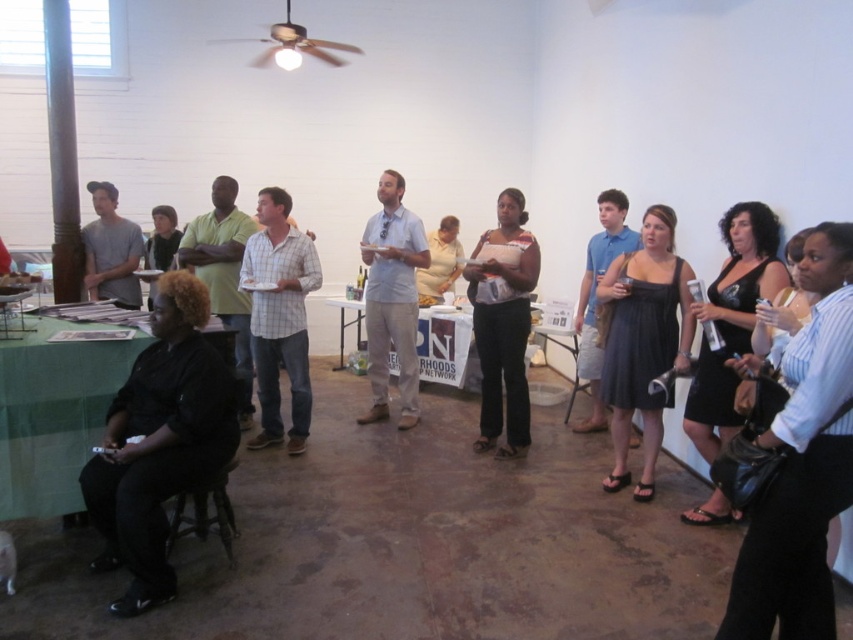
Does plaid shirt at center have a larger size compared to light blue cotton shirt at center?

No.

Who is shorter, plaid shirt at center or light blue cotton shirt at center?

plaid shirt at center

The image size is (853, 640). Describe the element at coordinates (279, 316) in the screenshot. I see `plaid shirt at center` at that location.

Identify the location of plaid shirt at center. This screenshot has height=640, width=853. (279, 316).

Is green fabric table at lower left wider than matte black dress at center?

Yes.

Which of these two, green fabric table at lower left or matte black dress at center, stands taller?

Standing taller between the two is matte black dress at center.

Is point (99, 396) closer to viewer compared to point (477, 262)?

Yes, point (99, 396) is closer to viewer.

Identify the location of green fabric table at lower left. This screenshot has height=640, width=853. (55, 412).

In the scene shown: Who is more forward, [845,305] or [82,408]?

Point [845,305] is in front.

Measure the distance between black dress at right and green fabric table at lower left.

black dress at right is 2.38 meters from green fabric table at lower left.

In order to click on black dress at right in this screenshot , I will do `click(802, 464)`.

The width and height of the screenshot is (853, 640). In order to click on black dress at right in this screenshot , I will do pos(802,464).